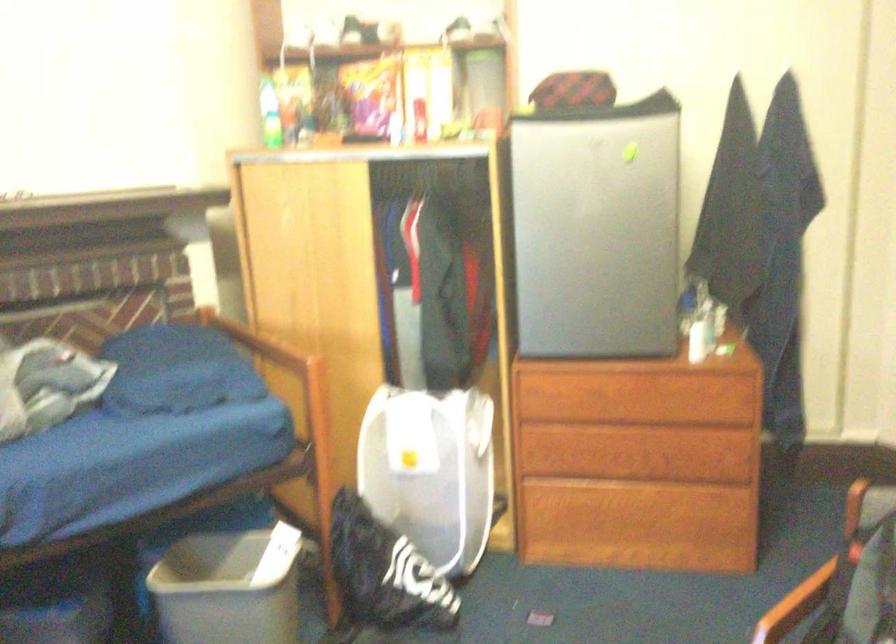
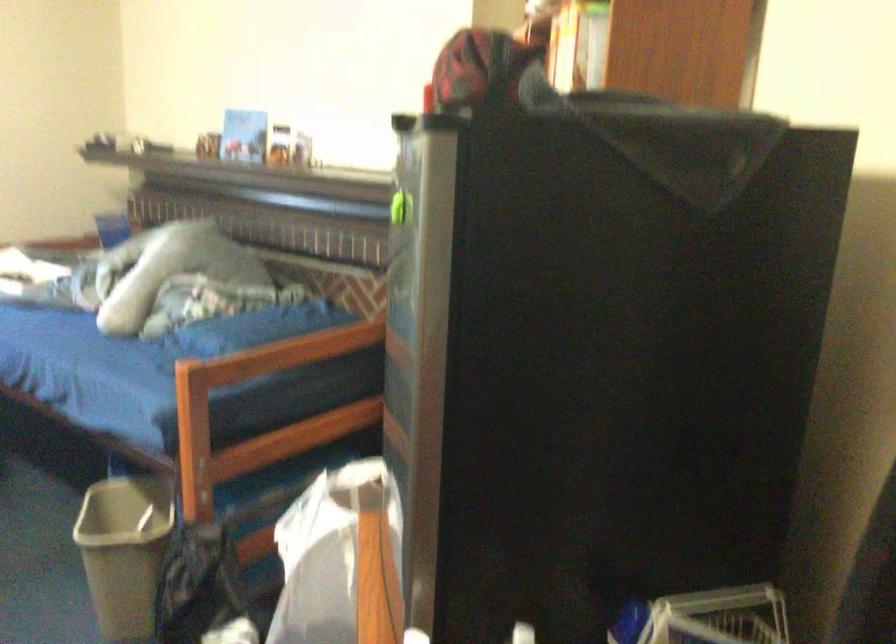
The point at (691,299) is marked in the first image. Where is the corresponding point in the second image?

(719, 617)